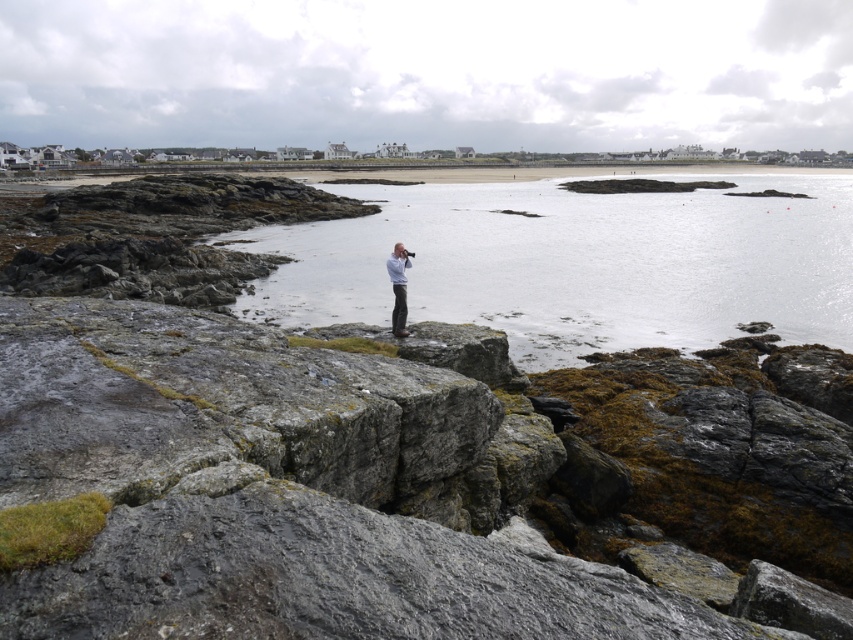
Does gray rock at center come in front of clear water at center?

Yes.

Who is positioned more to the right, gray rock at center or clear water at center?

From the viewer's perspective, clear water at center appears more on the right side.

Is point (457, 326) in front of point (633, 227)?

Yes, it is.

The width and height of the screenshot is (853, 640). Find the location of `gray rock at center`. gray rock at center is located at coordinates (332, 492).

How much distance is there between clear water at center and white matte shirt at center?

A distance of 57.43 meters exists between clear water at center and white matte shirt at center.

Is point (585, 227) positioned in front of point (403, 262)?

That is False.

This screenshot has width=853, height=640. Identify the location of clear water at center. (576, 262).

Does gray rock at center appear on the left side of white matte shirt at center?

Incorrect, gray rock at center is not on the left side of white matte shirt at center.

Between point (343, 460) and point (402, 332), which one is positioned in front?

Point (343, 460)

Is point (32, 368) more distant than point (402, 291)?

No, (32, 368) is in front of (402, 291).

Find the location of a particular element. The image size is (853, 640). gray rock at center is located at coordinates (332, 492).